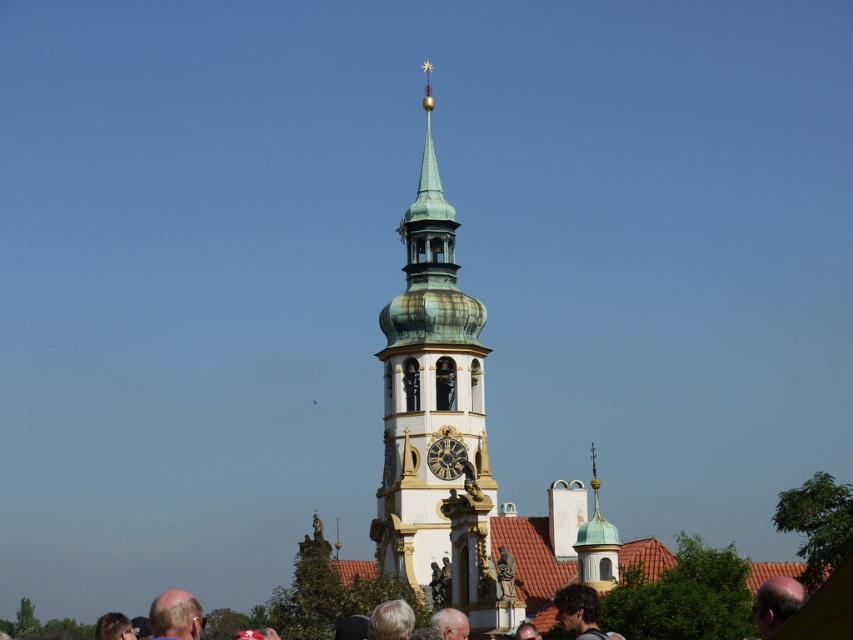
You are standing in front of the green copper clock tower at center and the blonde hair at lower left. Which object is taller?

The green copper clock tower at center is taller than the blonde hair at lower left.

You are a photographer standing in front of the clock tower. You notice two people in the scene, one with light brown hair at lower left and another with gray hair at lower center. Which person has a higher position relative to the clock tower?

The light brown hair at lower left is taller than gray hair at lower center, so the person with light brown hair at lower left has a higher position relative to the clock tower.

You are a photographer standing at the base of the green copper clock tower at center. You notice a person with blonde hair at lower left in your viewfinder. Which object appears wider in your photo?

The blonde hair at lower left appears wider than the green copper clock tower at center because the description states that the green copper clock tower at center is thinner than blonde hair at lower left.